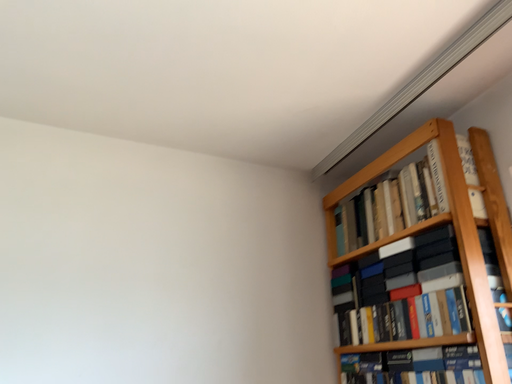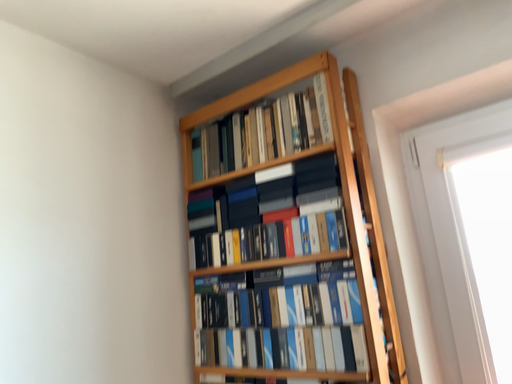
Question: How did the camera likely rotate when shooting the video?

Choices:
 (A) rotated downward
 (B) rotated upward

Answer: (A)